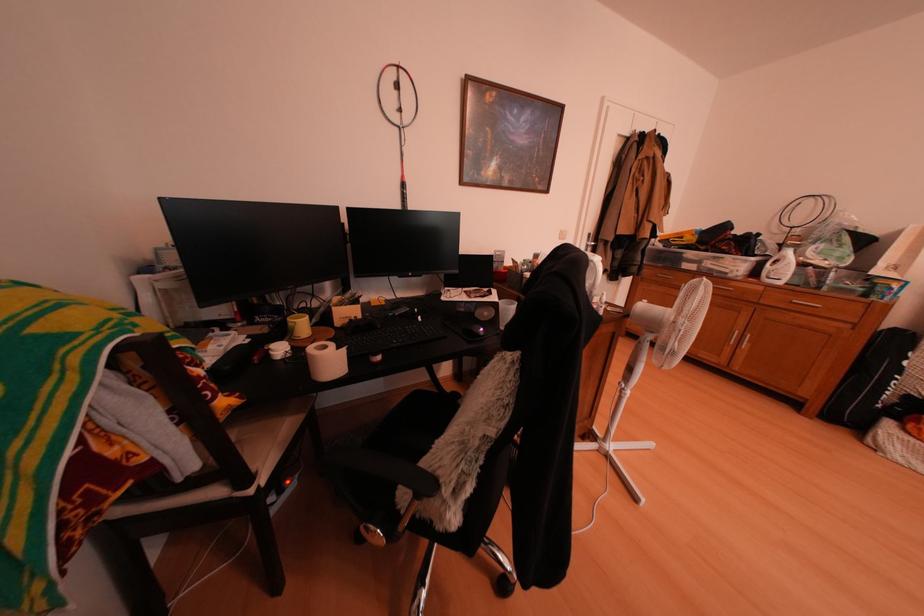
The height and width of the screenshot is (616, 924). Find the location of `black chair armrest`. black chair armrest is located at coordinates (404, 474).